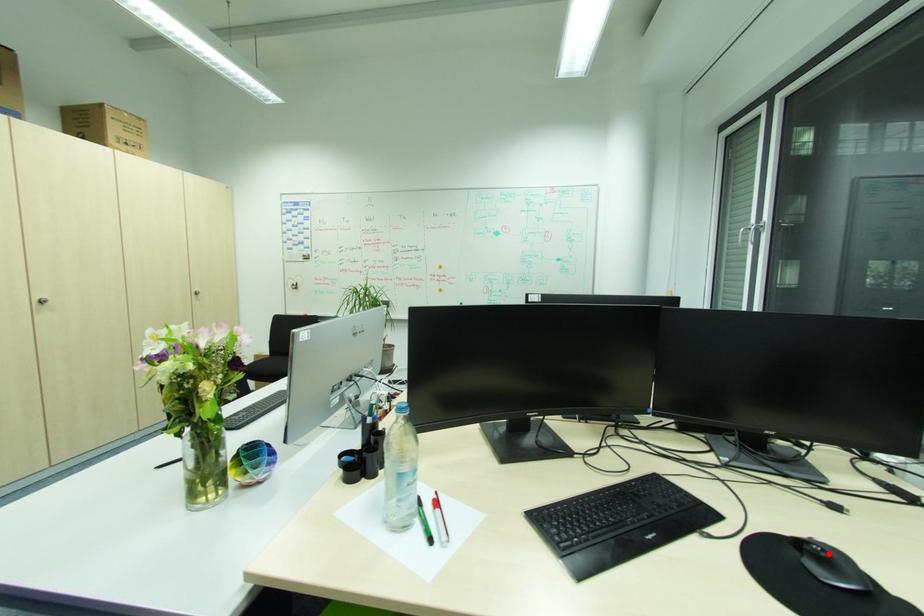
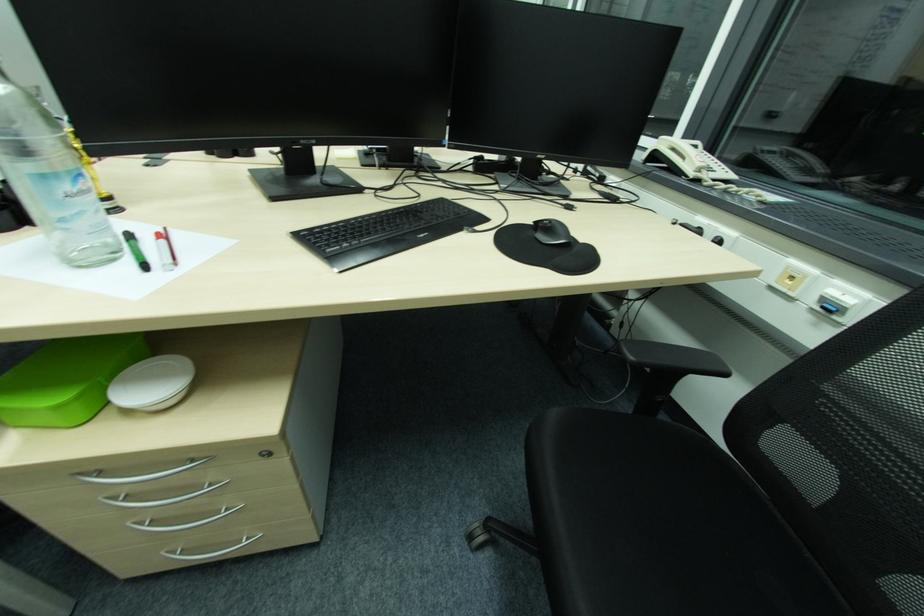
The point at the highlighted location is marked in the first image. Where is the corresponding point in the second image?

(554, 225)